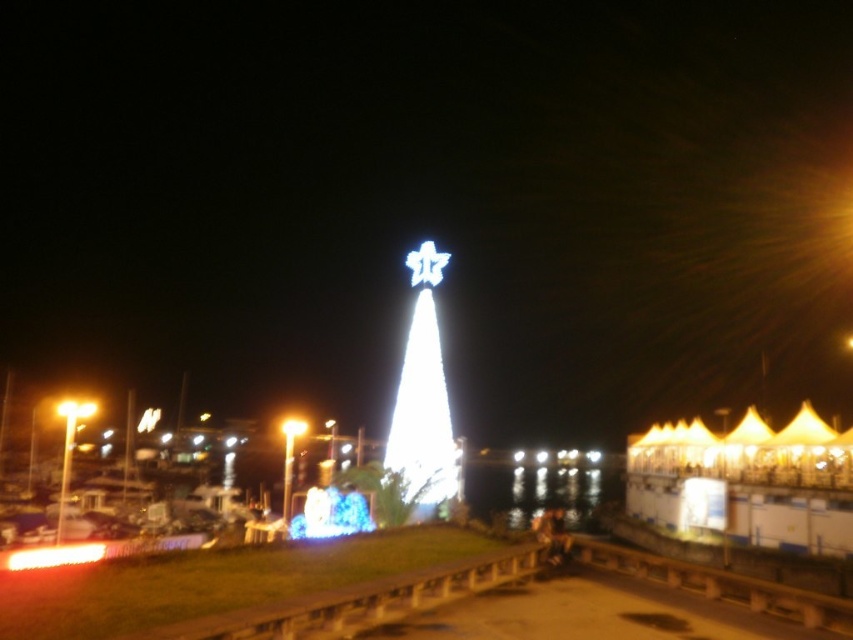
You are an event planner setting up decorations for a holiday event. You have two lights to place on a central stage. The white illuminated cone at center and the matte yellow light at center. According to the scene, which light should be placed closer to the audience to ensure visibility?

The white illuminated cone at center should be placed closer to the audience because it is in front of the matte yellow light at center, ensuring better visibility.

You are standing at the point with coordinates (x=422, y=397) in the nighttime waterfront scene. What object is exactly at your current location?

The white illuminated cone at center is located at point (x=422, y=397).